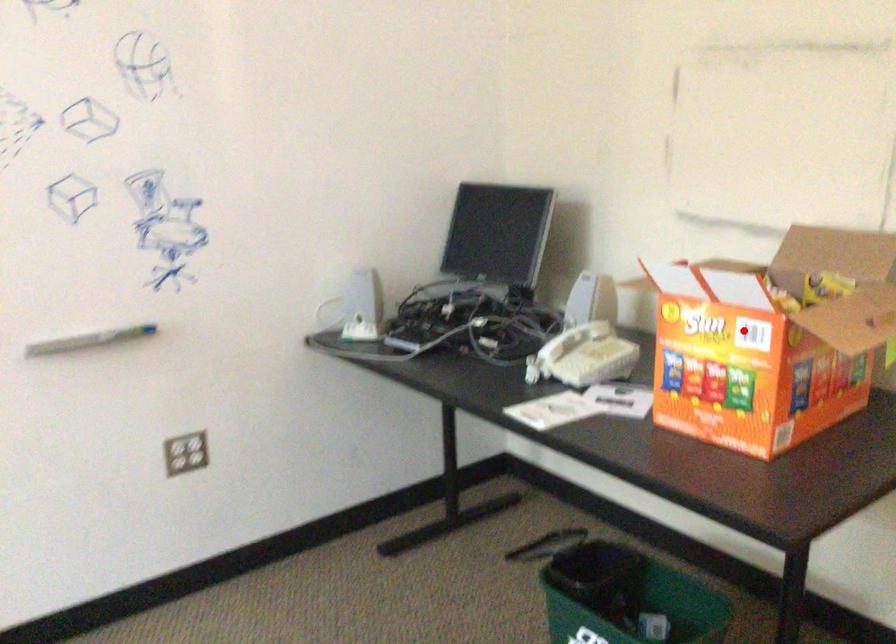
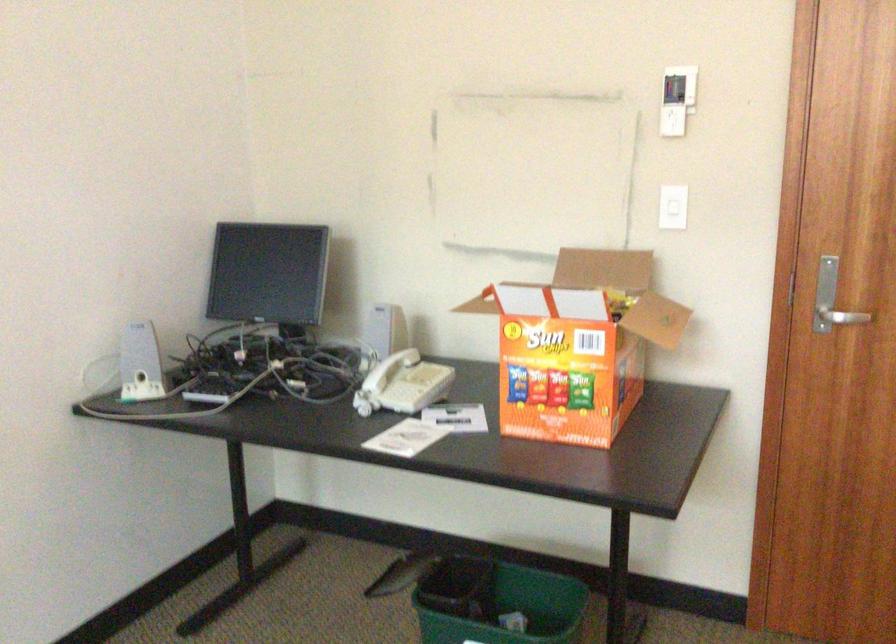
Question: A red point is marked in image1. In image2, is the corresponding 3D point closer to the camera or farther? Reply with the corresponding letter.

Choices:
 (A) The corresponding 3D point is closer.
 (B) The corresponding 3D point is farther.

Answer: (B)